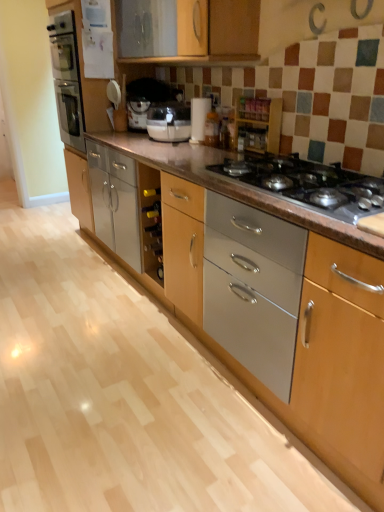
Where is `metallic gray gas stove at center`? This screenshot has height=512, width=384. metallic gray gas stove at center is located at coordinates (309, 184).

Image resolution: width=384 pixels, height=512 pixels. What do you see at coordinates (199, 118) in the screenshot?
I see `white paper towel holder at center` at bounding box center [199, 118].

In the scene shown: What is the approximate width of white plastic coffee machine at center?

It is 12.60 inches.

You are a GUI agent. You are given a task and a screenshot of the screen. Output one action in this format:
    pyautogui.click(x=<x>, y=<y>)
    Task: Click on the metallic gray gas stove at center
    
    Given the screenshot: What is the action you would take?
    pyautogui.click(x=309, y=184)

Is metallic gray gas stove at center inside white paper towel holder at center?

That's incorrect, metallic gray gas stove at center is not inside white paper towel holder at center.

Is white paper towel holder at center bigger or smaller than metallic gray gas stove at center?

Clearly, white paper towel holder at center is smaller in size than metallic gray gas stove at center.

How different are the orientations of white paper towel holder at center and metallic gray gas stove at center in degrees?

The angle between the facing direction of white paper towel holder at center and the facing direction of metallic gray gas stove at center is 9.15 degrees.

Measure the distance from white paper towel holder at center to metallic gray gas stove at center.

white paper towel holder at center is 38.48 inches from metallic gray gas stove at center.

Is metallic gray gas stove at center positioned before white plastic coffee machine at center?

Yes, the depth of metallic gray gas stove at center is less than that of white plastic coffee machine at center.

Is metallic gray gas stove at center facing towards white plastic coffee machine at center?

No, metallic gray gas stove at center is not facing towards white plastic coffee machine at center.

Between metallic gray gas stove at center and white plastic coffee machine at center, which one has larger width?

metallic gray gas stove at center.

Is metallic gray gas stove at center not inside white plastic coffee machine at center?

metallic gray gas stove at center lies outside white plastic coffee machine at center's area.

In terms of size, does white plastic coffee machine at center appear bigger or smaller than white paper towel holder at center?

Considering their sizes, white plastic coffee machine at center takes up more space than white paper towel holder at center.

Is white plastic coffee machine at center looking in the opposite direction of white paper towel holder at center?

white plastic coffee machine at center is not turned away from white paper towel holder at center.

Considering the positions of objects white plastic coffee machine at center and white paper towel holder at center in the image provided, who is behind, white plastic coffee machine at center or white paper towel holder at center?

→ white plastic coffee machine at center is behind.

Locate an element on the screen. Image resolution: width=384 pixels, height=512 pixels. cabinetry in front of the white plastic coffee machine at center is located at coordinates (258, 124).

In terms of height, does wooden spice rack at upper center look taller or shorter compared to white plastic coffee machine at center?

wooden spice rack at upper center is shorter than white plastic coffee machine at center.

In the image, is wooden spice rack at upper center positioned in front of or behind metallic gray gas stove at center?

wooden spice rack at upper center is behind metallic gray gas stove at center.

Considering the positions of point (257, 137) and point (261, 161), is point (257, 137) closer or farther from the camera than point (261, 161)?

Point (257, 137) is positioned farther from the camera compared to point (261, 161).

Identify the location of gas stove in front of the wooden spice rack at upper center. (309, 184).

Is metallic gray gas stove at center not inside wooden spice rack at upper center?

That's correct, metallic gray gas stove at center is outside of wooden spice rack at upper center.

Based on their positions, is metallic gray gas stove at center located to the left or right of wooden spice rack at upper center?

Based on their positions, metallic gray gas stove at center is located to the right of wooden spice rack at upper center.

From the image's perspective, does metallic gray gas stove at center appear higher than wooden spice rack at upper center?

No, from the image's perspective, metallic gray gas stove at center is not on top of wooden spice rack at upper center.

From a real-world perspective, is metallic gray gas stove at center located beneath wooden spice rack at upper center?

Yes, from a real-world perspective, metallic gray gas stove at center is below wooden spice rack at upper center.

Is wooden spice rack at upper center located within white paper towel holder at center?

Definitely not — wooden spice rack at upper center is not inside white paper towel holder at center.

Is white paper towel holder at center shorter than wooden spice rack at upper center?

No, white paper towel holder at center is not shorter than wooden spice rack at upper center.

Is point (200, 101) farther from viewer compared to point (254, 111)?

Yes, it is.

In the image, there is a white paper towel holder at center. At what (x,y) coordinates should I click in order to perform the action: click on gas stove below it (from the image's perspective). Please return your answer as a coordinate pair (x, y). This screenshot has height=512, width=384. Looking at the image, I should click on (309, 184).

This screenshot has width=384, height=512. Identify the location of coffee machine above the metallic gray gas stove at center (from the image's perspective). (144, 99).

Looking at the image, which one is located further to metallic gray gas stove at center, white plastic coffee machine at center or wooden spice rack at upper center?

Among the two, white plastic coffee machine at center is located further to metallic gray gas stove at center.

Estimate the real-world distances between objects in this image. Which object is closer to wooden spice rack at upper center, metallic gray gas stove at center or white paper towel holder at center?

white paper towel holder at center lies closer to wooden spice rack at upper center than the other object.

Estimate the real-world distances between objects in this image. Which object is closer to wooden spice rack at upper center, white paper towel holder at center or metallic gray gas stove at center?

white paper towel holder at center lies closer to wooden spice rack at upper center than the other object.

Based on their spatial positions, is white plastic coffee machine at center or wooden spice rack at upper center closer to white paper towel holder at center?

Based on the image, wooden spice rack at upper center appears to be nearer to white paper towel holder at center.

Which object lies nearer to the anchor point wooden spice rack at upper center, white plastic coffee machine at center or metallic gray gas stove at center?

metallic gray gas stove at center is closer to wooden spice rack at upper center.

From the image, which object appears to be farther from metallic gray gas stove at center, wooden spice rack at upper center or white paper towel holder at center?

white paper towel holder at center is further to metallic gray gas stove at center.

When comparing their distances from white paper towel holder at center, does wooden spice rack at upper center or metallic gray gas stove at center seem further?

Among the two, metallic gray gas stove at center is located further to white paper towel holder at center.

Based on the photo, estimate the real-world distances between objects in this image. Which object is further from white paper towel holder at center, wooden spice rack at upper center or white plastic coffee machine at center?

Among the two, white plastic coffee machine at center is located further to white paper towel holder at center.

Identify the location of cabinetry between metallic gray gas stove at center and white plastic coffee machine at center from front to back. (258, 124).

At what (x,y) coordinates should I click in order to perform the action: click on appliance between wooden spice rack at upper center and white plastic coffee machine at center from front to back. Please return your answer as a coordinate pair (x, y). Looking at the image, I should click on (199, 118).

Locate an element on the screen. This screenshot has height=512, width=384. appliance between metallic gray gas stove at center and white plastic coffee machine at center in the front-back direction is located at coordinates (199, 118).

Locate an element on the screen. cabinetry between metallic gray gas stove at center and white paper towel holder at center from front to back is located at coordinates (258, 124).